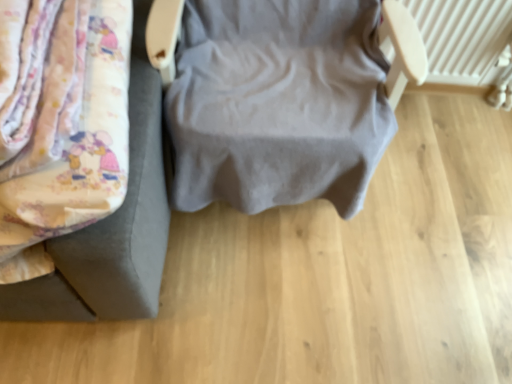
Question: Would you say fluffy fabric bed at left, acting as the 2th furniture starting from the right, is inside or outside gray fabric chair at center, which is the 1th furniture in right-to-left order?

Choices:
 (A) outside
 (B) inside

Answer: (A)

Question: Is fluffy fabric bed at left, which is the first furniture in left-to-right order, bigger or smaller than gray fabric chair at center, which is counted as the second furniture, starting from the left?

Choices:
 (A) small
 (B) big

Answer: (A)

Question: Estimate the real-world distances between objects in this image. Which object is closer to the fluffy fabric bed at left, acting as the 2th furniture starting from the right?

Choices:
 (A) white textured radiator at upper right
 (B) gray fabric chair at center, which is the 1th furniture in right-to-left order

Answer: (B)

Question: Based on their relative distances, which object is farther from the gray fabric chair at center, which is counted as the second furniture, starting from the left?

Choices:
 (A) fluffy fabric bed at left, which is the first furniture in left-to-right order
 (B) white textured radiator at upper right

Answer: (B)